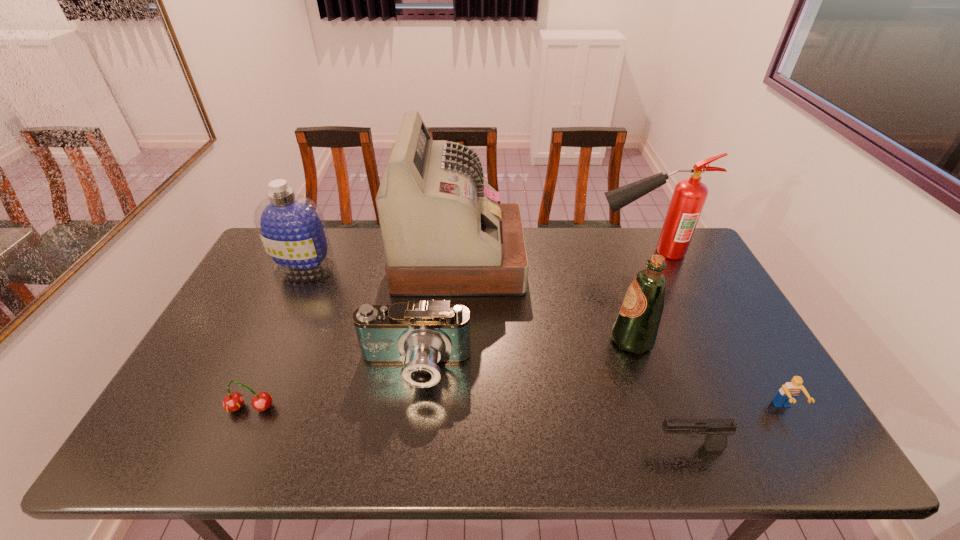
The width and height of the screenshot is (960, 540). I want to click on vacant region located 0.070m with stems pointing upwards on the cherry, so click(234, 444).

Locate an element on the screen. free space located 0.070m on the face of the Lego is located at coordinates (806, 447).

This screenshot has width=960, height=540. In order to click on cash register located in the far edge section of the desktop in this screenshot , I will do `click(444, 234)`.

Find the location of a particular element. Image resolution: width=960 pixels, height=540 pixels. fire extinguisher located in the far edge section of the desktop is located at coordinates (689, 196).

Where is `cleansing agent that is at the far edge`? cleansing agent that is at the far edge is located at coordinates (292, 229).

In order to click on object at the near edge in this screenshot , I will do `click(715, 430)`.

This screenshot has width=960, height=540. Identify the location of cleansing agent that is at the left edge. (292, 229).

This screenshot has width=960, height=540. I want to click on cherry that is at the left edge, so click(x=233, y=401).

This screenshot has width=960, height=540. What are the coordinates of `fire extinguisher positioned at the right edge` in the screenshot? It's located at (689, 196).

This screenshot has height=540, width=960. I want to click on Lego at the right edge, so click(x=787, y=394).